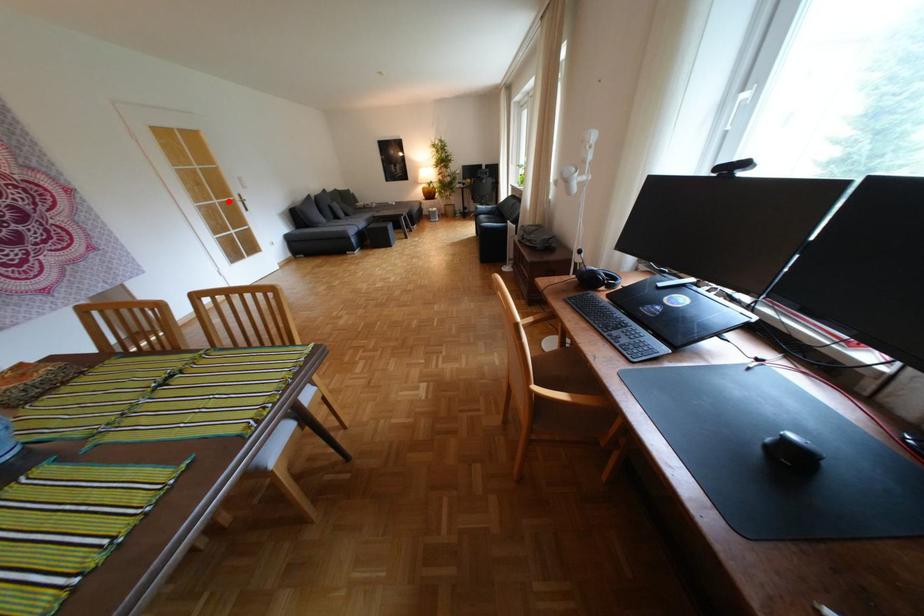
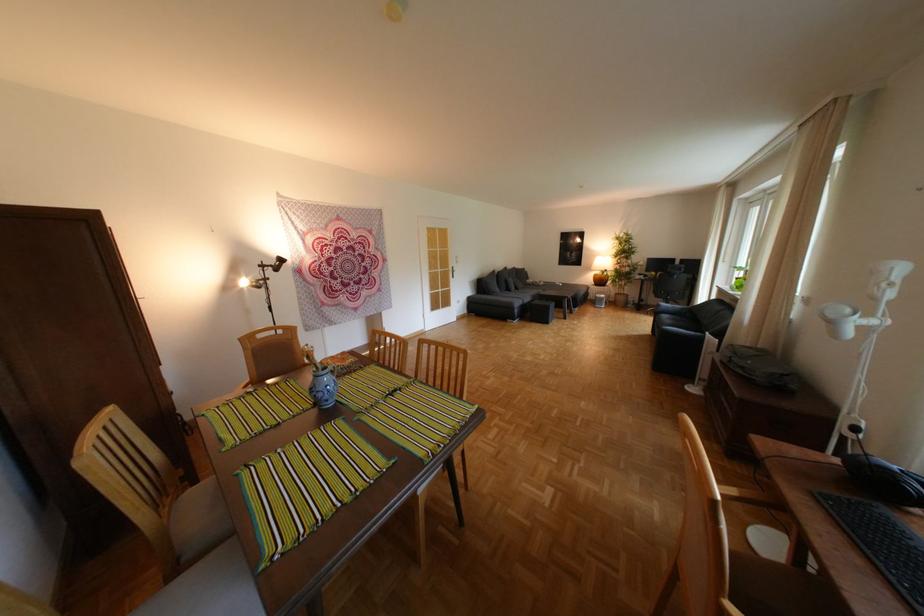
The point at the highlighted location is marked in the first image. Where is the corresponding point in the second image?

(453, 270)